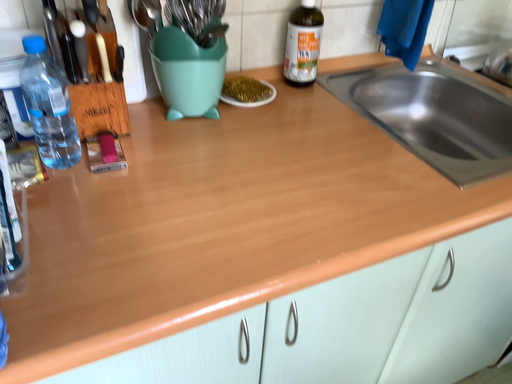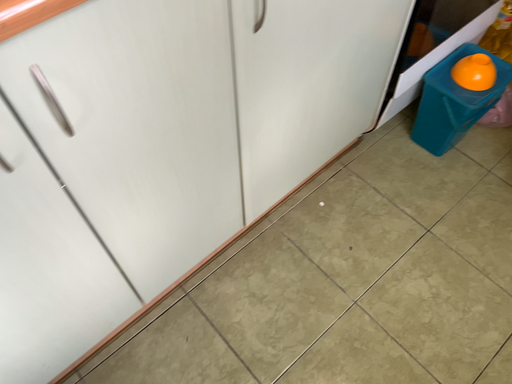
Question: Which way did the camera rotate in the video?

Choices:
 (A) rotated upward
 (B) rotated downward

Answer: (B)